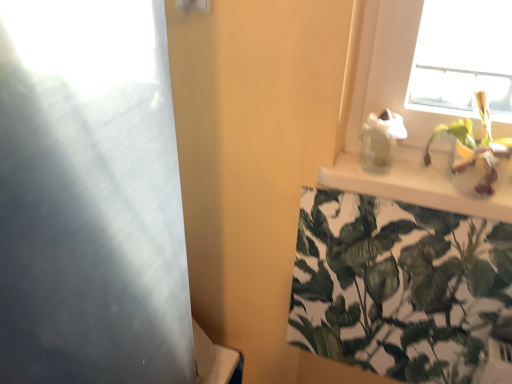
I want to click on free location above white glossy shelf at upper right (from a real-world perspective), so [399, 176].